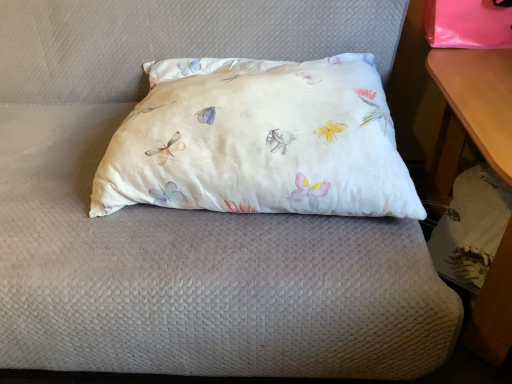
Image resolution: width=512 pixels, height=384 pixels. What are the coordinates of `white satin pillow at center` in the screenshot? It's located at (259, 141).

Describe the element at coordinates (259, 141) in the screenshot. I see `white satin pillow at center` at that location.

Identify the location of white satin pillow at center. The width and height of the screenshot is (512, 384). (259, 141).